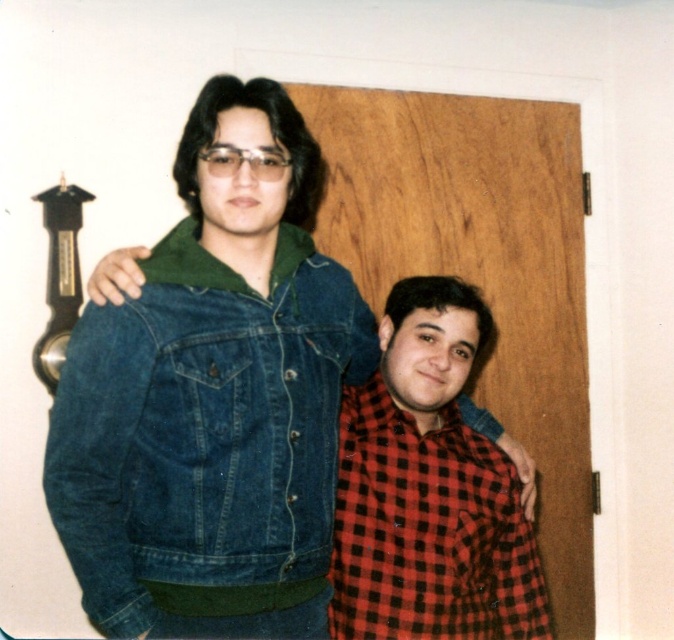
You are a security camera installed on the ceiling of the room. You need to determine if the denim jacket at upper left is positioned higher than the red checkered shirt at lower right. Based on the scene, what is your observation?

The denim jacket at upper left is above the red checkered shirt at lower right, so it is positioned higher.

You are standing in front of the wooden door and want to reach the denim jacket at upper left. Which direction should you move relative to the point at coordinates (214, 396)?

The denim jacket at upper left is located at the point (214, 396), so you are already at the correct position to reach it.